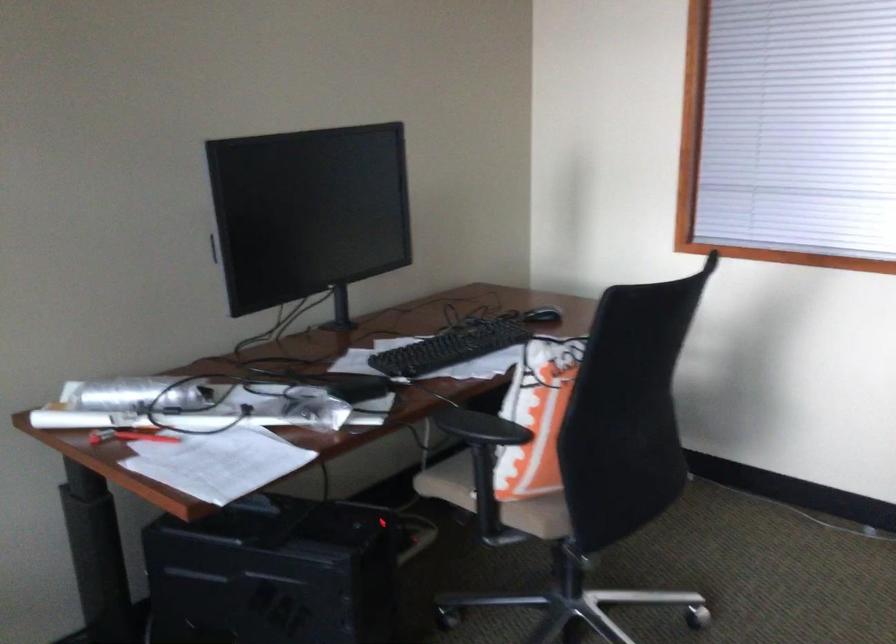
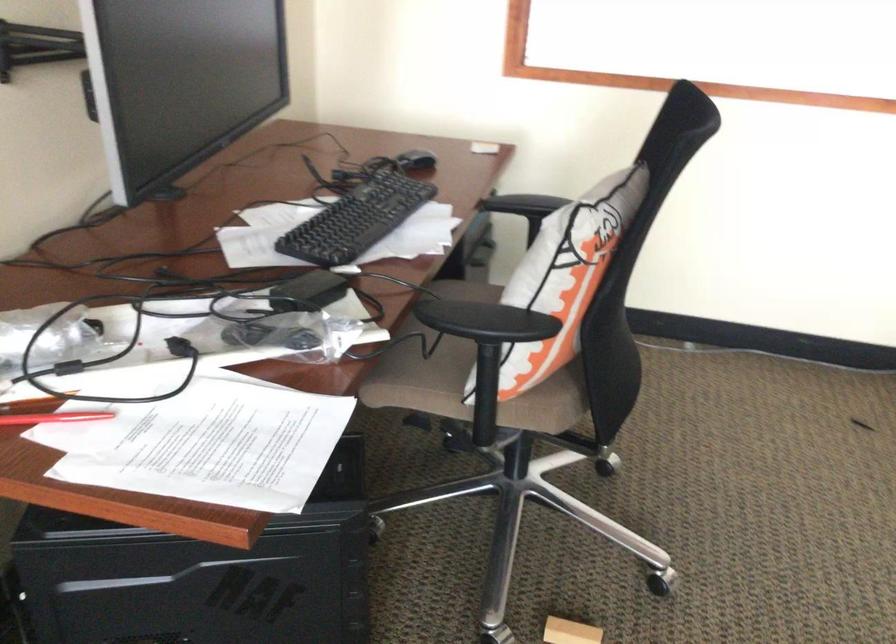
Where in the second image is the point corresponding to point (147, 438) from the first image?

(54, 418)